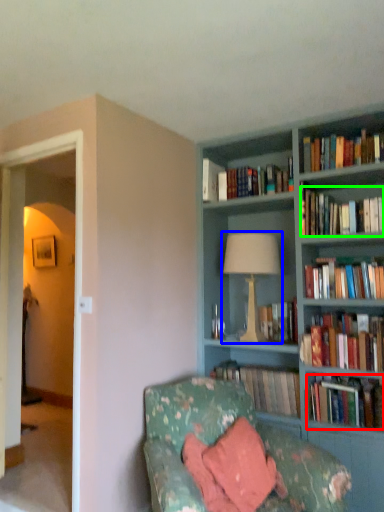
Question: Which is farther away from book (highlighted by a red box)? table lamp (highlighted by a blue box) or book (highlighted by a green box)?

Choices:
 (A) table lamp
 (B) book

Answer: (B)